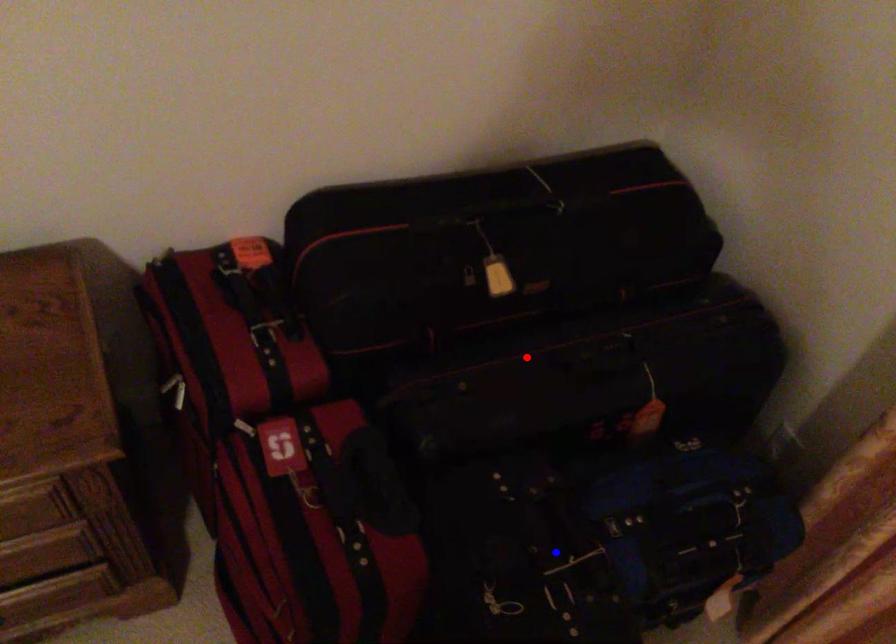
Question: In the image, two points are highlighted. Which point is nearer to the camera? Reply with the corresponding letter.

Choices:
 (A) blue point
 (B) red point

Answer: (A)